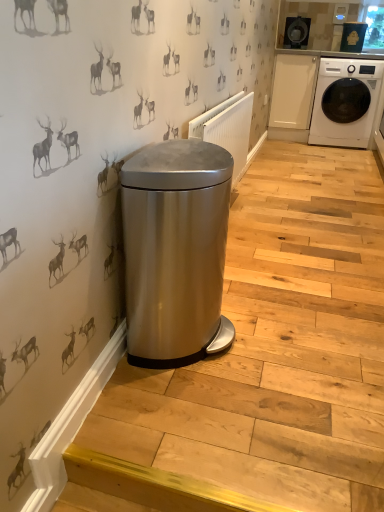
Find the location of a particular element. The height and width of the screenshot is (512, 384). free space in front of satin silver radiator at center is located at coordinates (277, 274).